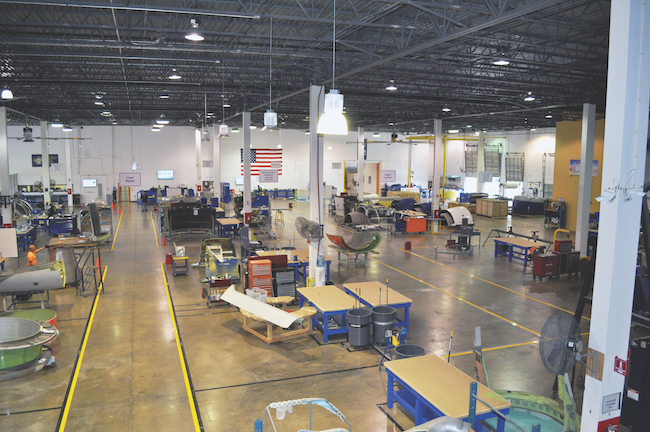
This screenshot has height=432, width=650. Find the location of `ceiling`. ceiling is located at coordinates (234, 44).